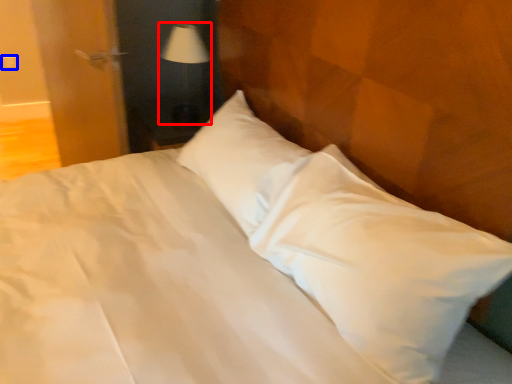
Question: Among these objects, which one is farthest to the camera, table lamp (highlighted by a red box) or electric outlet (highlighted by a blue box)?

Choices:
 (A) table lamp
 (B) electric outlet

Answer: (B)